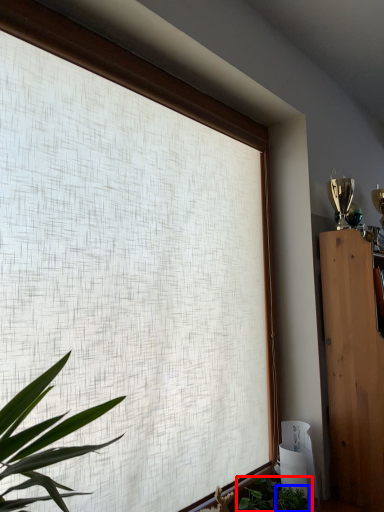
Question: Which object is further to the camera taking this photo, houseplant (highlighted by a red box) or plant (highlighted by a blue box)?

Choices:
 (A) houseplant
 (B) plant

Answer: (A)